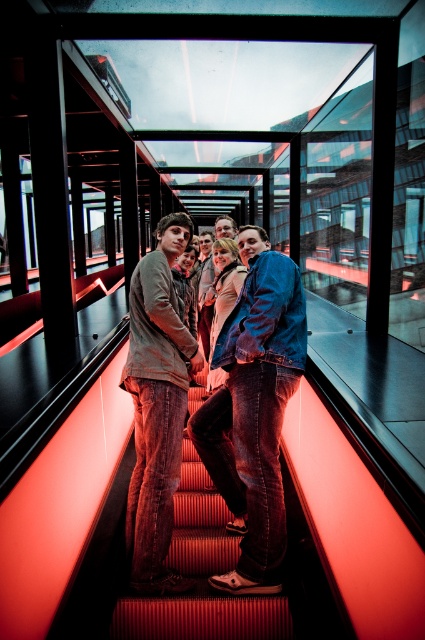
Question: Which object appears closest to the camera in this image?

Choices:
 (A) smooth red carpet at center
 (B) denim jacket at center

Answer: (A)

Question: From the image, what is the correct spatial relationship of matte gray hoodie at center in relation to smooth red carpet at center?

Choices:
 (A) below
 (B) above

Answer: (B)

Question: Which point is farther to the camera?

Choices:
 (A) (144, 376)
 (B) (282, 376)
 (C) (220, 561)

Answer: (C)

Question: Does denim jacket at center appear under matte gray hoodie at center?

Choices:
 (A) no
 (B) yes

Answer: (B)

Question: Which object is positioned closest to the smooth red carpet at center?

Choices:
 (A) matte gray hoodie at center
 (B) denim jacket at center

Answer: (A)

Question: Observing the image, what is the correct spatial positioning of denim jacket at center in reference to smooth red carpet at center?

Choices:
 (A) left
 (B) right

Answer: (B)